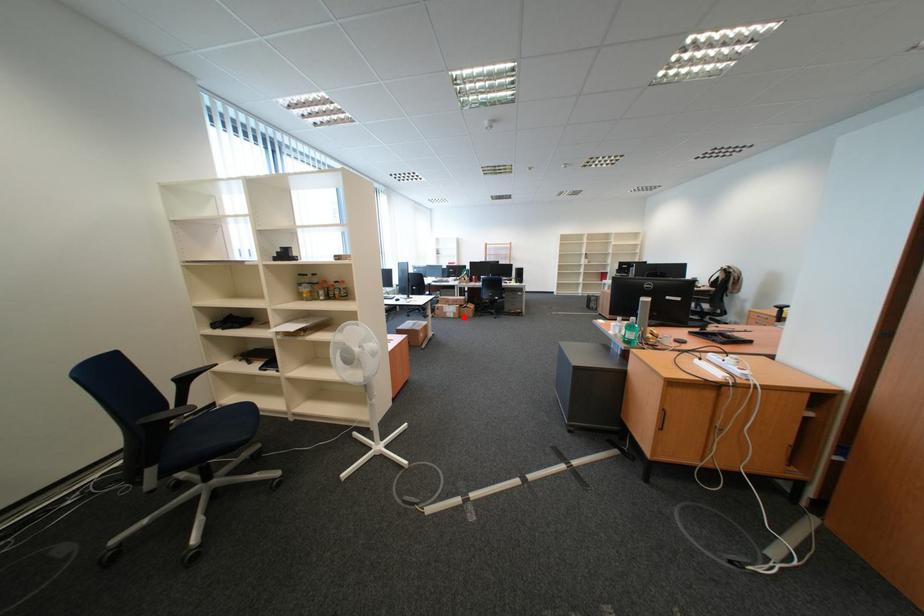
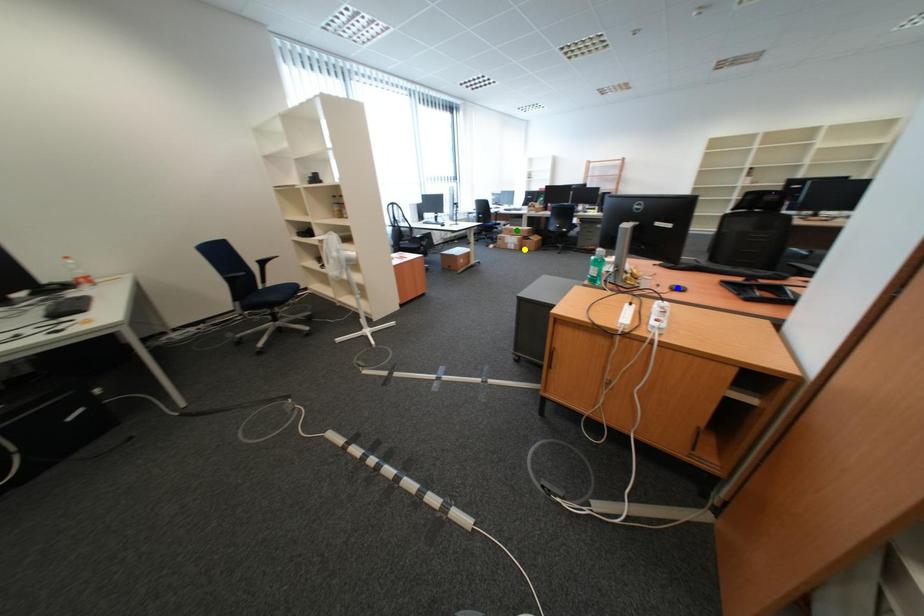
Question: I am providing you with two images of the same scene from different viewpoints. A red point is marked on the first image. You are given multiple points on the second image. In image 2, which mark is for the same physical point as the one in image 1?

Choices:
 (A) yellow point
 (B) green point
 (C) blue point

Answer: (A)